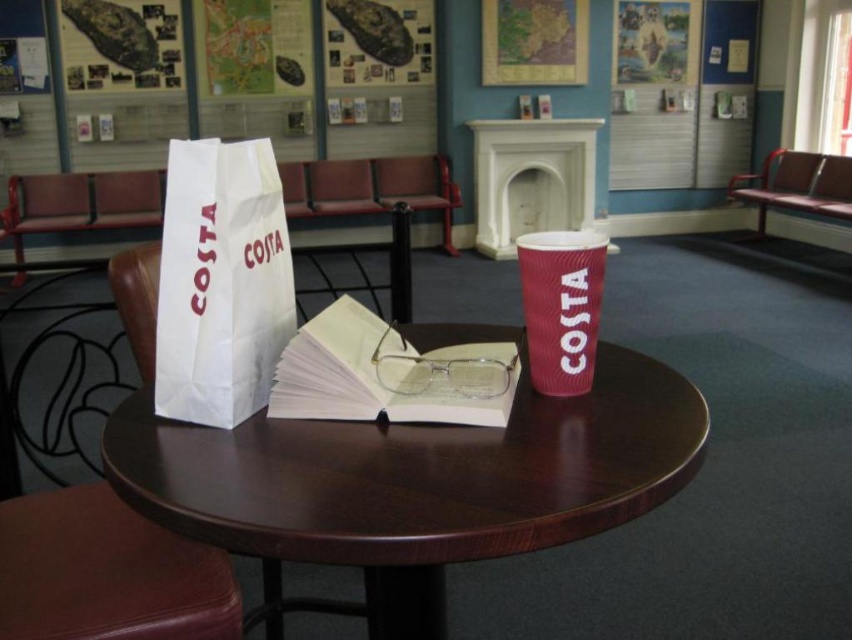
You are organizing items on a round wooden table and need to place both the white paper bag at center and the matte red cup at center. If you want to ensure both items fit side by side without overlapping, which item should you place closer to the edge of the table?

The matte red cup at center has a smaller width than the white paper bag at center, so placing it closer to the edge of the table would allow both items to fit side by side without overlapping.